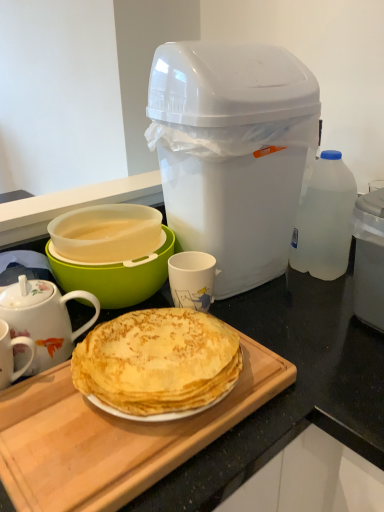
Question: From the image's perspective, is porcelain floral teapot at left beneath transparent plastic bottle at right?

Choices:
 (A) yes
 (B) no

Answer: (A)

Question: Considering the relative sizes of porcelain floral teapot at left and transparent plastic bottle at right in the image provided, is porcelain floral teapot at left shorter than transparent plastic bottle at right?

Choices:
 (A) yes
 (B) no

Answer: (A)

Question: Would you say porcelain floral teapot at left is a long distance from transparent plastic bottle at right?

Choices:
 (A) yes
 (B) no

Answer: (B)

Question: From the image's perspective, does porcelain floral teapot at left appear higher than transparent plastic bottle at right?

Choices:
 (A) no
 (B) yes

Answer: (A)

Question: Is porcelain floral teapot at left turned away from transparent plastic bottle at right?

Choices:
 (A) yes
 (B) no

Answer: (B)

Question: From a real-world perspective, is porcelain floral teapot at left under transparent plastic bottle at right?

Choices:
 (A) yes
 (B) no

Answer: (A)

Question: Can you confirm if wooden cutting board at center is bigger than translucent plastic bowl at center left?

Choices:
 (A) no
 (B) yes

Answer: (A)

Question: Is wooden cutting board at center not within translucent plastic bowl at center left?

Choices:
 (A) no
 (B) yes

Answer: (B)

Question: Is wooden cutting board at center positioned before translucent plastic bowl at center left?

Choices:
 (A) yes
 (B) no

Answer: (A)

Question: From a real-world perspective, is wooden cutting board at center over translucent plastic bowl at center left?

Choices:
 (A) yes
 (B) no

Answer: (B)

Question: Does wooden cutting board at center appear on the left side of translucent plastic bowl at center left?

Choices:
 (A) yes
 (B) no

Answer: (B)

Question: Is wooden cutting board at center not close to translucent plastic bowl at center left?

Choices:
 (A) no
 (B) yes

Answer: (A)

Question: Considering the relative sizes of wooden cutting board at center and transparent plastic bottle at right in the image provided, is wooden cutting board at center smaller than transparent plastic bottle at right?

Choices:
 (A) no
 (B) yes

Answer: (A)